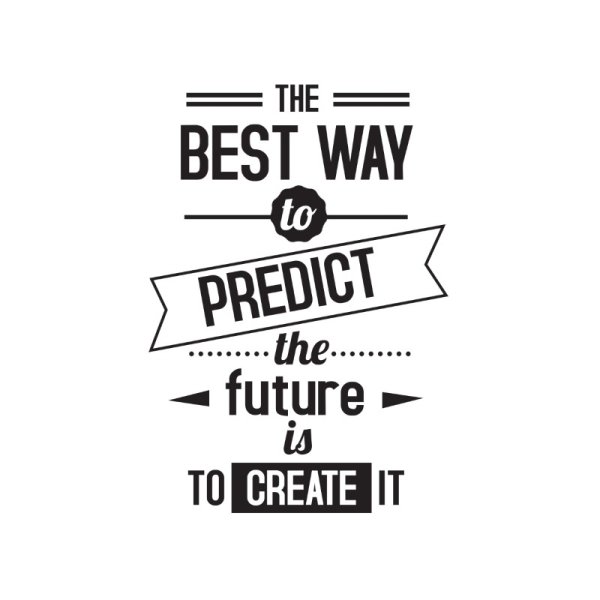
At what (x,y) coordinates should I click in order to perform the action: click on motivational graphic. Please return your answer as a coordinate pair (x, y). The height and width of the screenshot is (600, 600). Looking at the image, I should click on (328, 261).